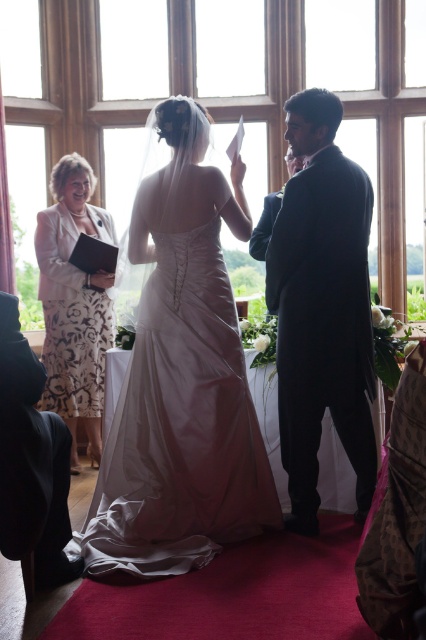
Does point (264, 484) lie in front of point (83, 316)?

Yes, it is in front of point (83, 316).

Can you confirm if white satin dress at center is positioned to the left of white floral dress at left?

In fact, white satin dress at center is to the right of white floral dress at left.

Does point (161, 499) come closer to viewer compared to point (88, 364)?

Yes, it is.

Identify the location of white satin dress at center. (181, 380).

Can you confirm if white satin dress at center is bigger than matte black jacket at left?

Indeed, white satin dress at center has a larger size compared to matte black jacket at left.

Who is more distant from viewer, (192, 152) or (66, 438)?

The point (192, 152) is behind.

Locate an element on the screen. white satin dress at center is located at coordinates (181, 380).

Between black satin suit at center and matte black jacket at left, which one appears on the left side from the viewer's perspective?

matte black jacket at left is more to the left.

Locate an element on the screen. The height and width of the screenshot is (640, 426). black satin suit at center is located at coordinates (322, 308).

Describe the element at coordinates (322, 308) in the screenshot. I see `black satin suit at center` at that location.

Identify the location of black satin suit at center. This screenshot has height=640, width=426. (322, 308).